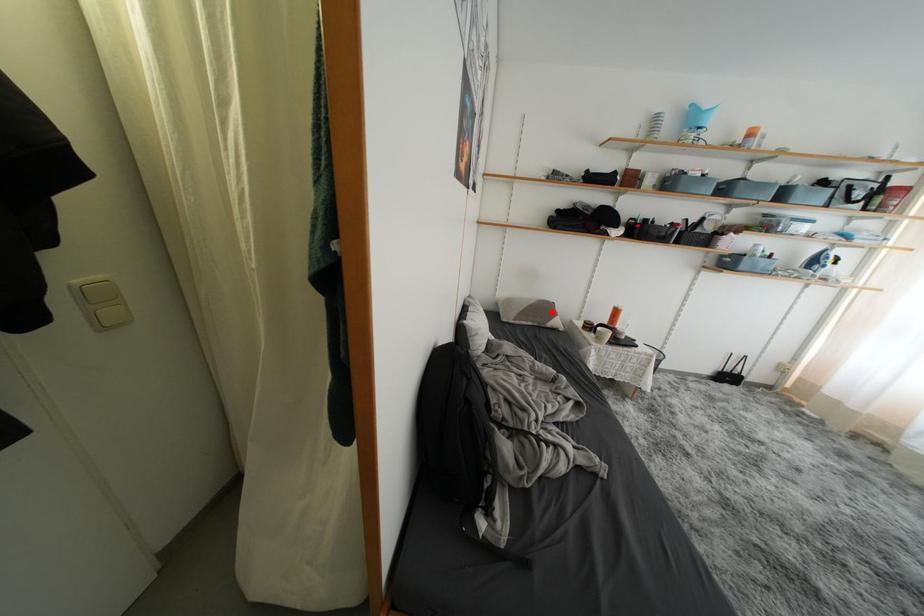
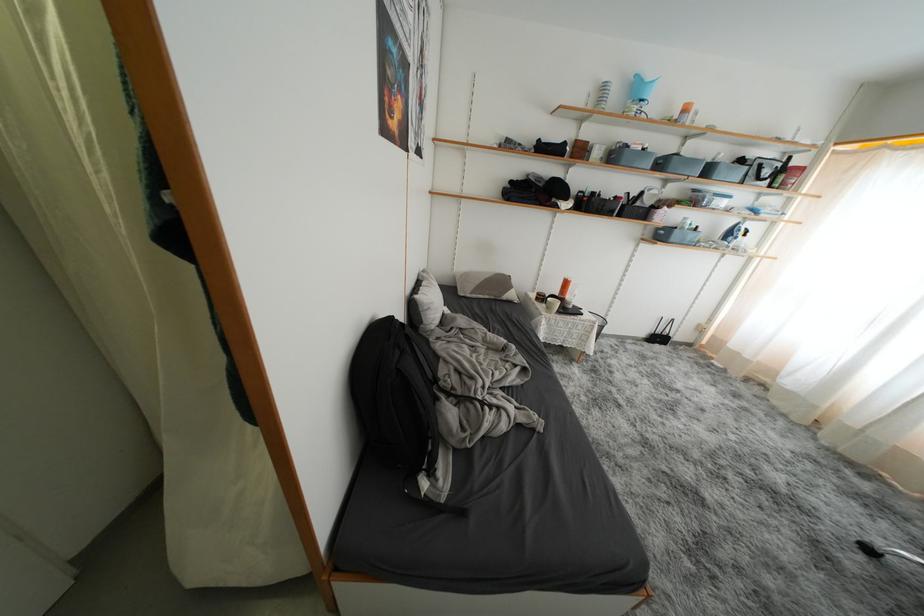
Question: I am providing you with two images of the same scene from different viewpoints. Given a red point in image1, look at the same physical point in image2. Is it:

Choices:
 (A) Closer to the viewpoint
 (B) Farther from the viewpoint

Answer: (A)